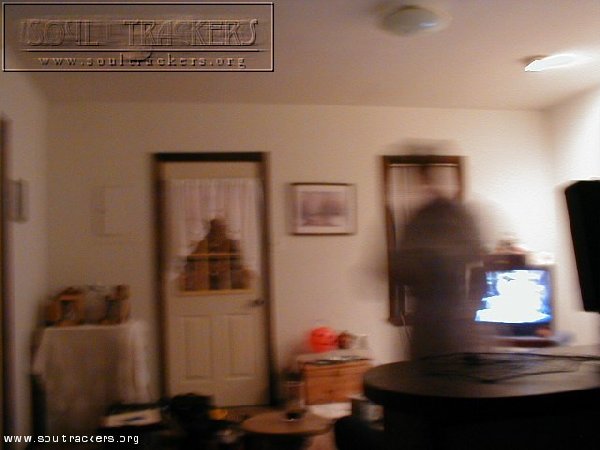
At what (x,y) coordinates should I click in order to perform the action: click on ceiling. Please return your answer as a coordinate pair (x, y). Looking at the image, I should click on (287, 56), (392, 67), (541, 23).